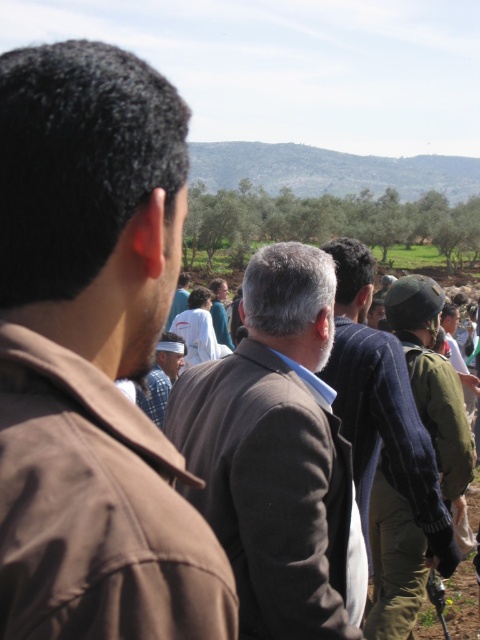
You are standing in the middle of the group and want to move towards the person in the brown fabric jacket at left without passing through the green military uniform at right. Is this possible?

Yes, since the brown fabric jacket at left is to the left of the green military uniform at right, you can move towards the brown fabric jacket at left by going around to the left side of the green military uniform at right.

From the picture: You are standing at the point marked by the coordinates point [160,376], which is the location of the blue plaid shirt at center. If you turn to face the person in the military clothing to your right, which direction should you turn?

The person in military clothing is to your right, so you should turn to your right to face them.